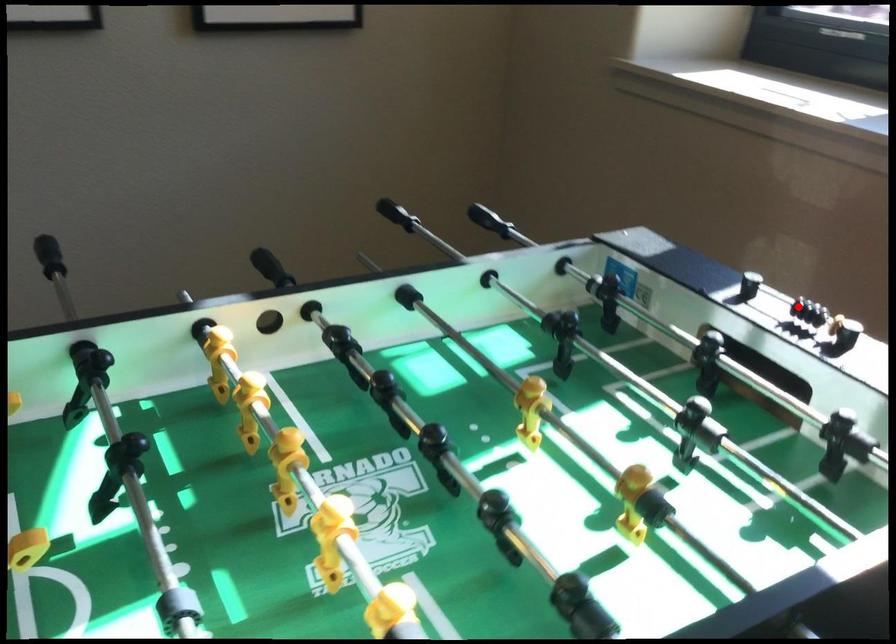
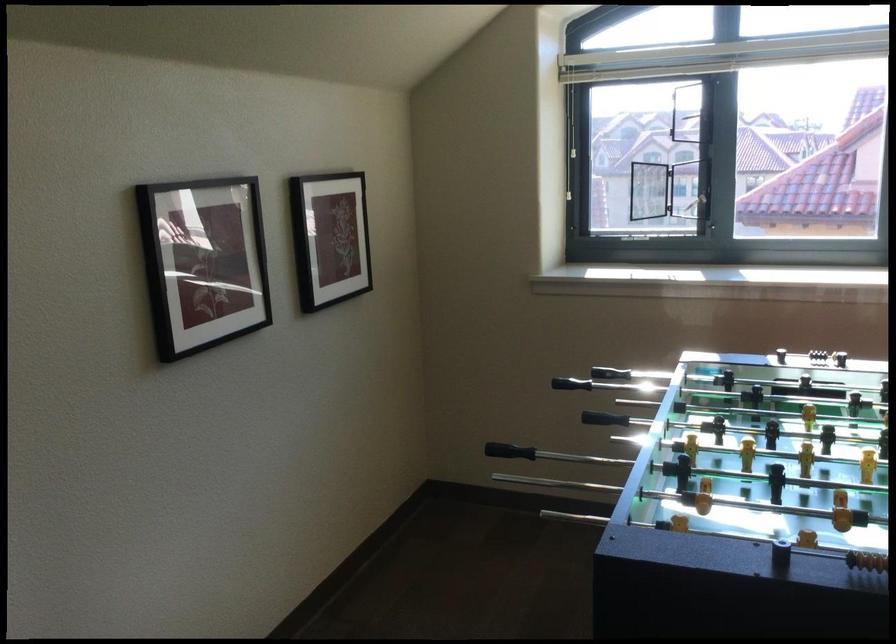
Where in the second image is the point corresponding to the highlighted location from the first image?

(806, 351)